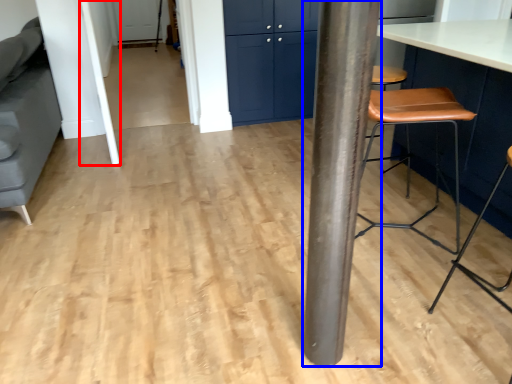
Question: Which object appears closest to the camera in this image, beam (highlighted by a red box) or pillar (highlighted by a blue box)?

Choices:
 (A) beam
 (B) pillar

Answer: (B)